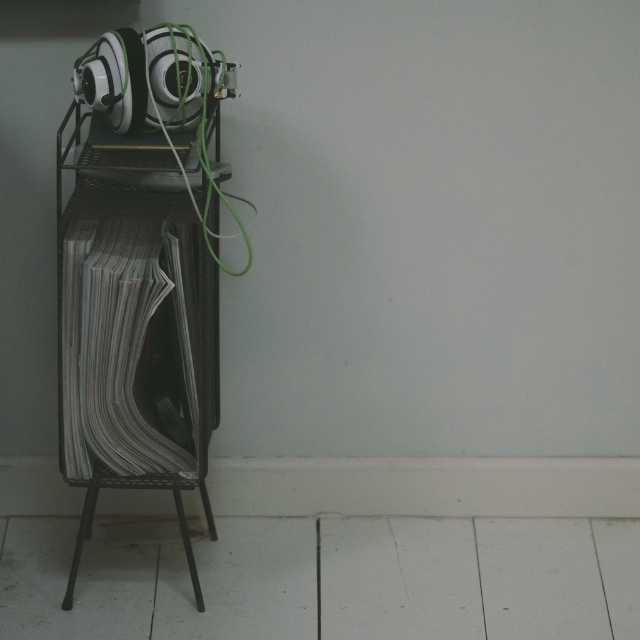
Is satin silver headphones at upper left taller than metallic stool at lower left?

In fact, satin silver headphones at upper left may be shorter than metallic stool at lower left.

Is satin silver headphones at upper left shorter than metallic stool at lower left?

Yes.

Identify the location of satin silver headphones at upper left. This screenshot has width=640, height=640. (150, 77).

Where is `satin silver headphones at upper left`? The width and height of the screenshot is (640, 640). satin silver headphones at upper left is located at coordinates (150, 77).